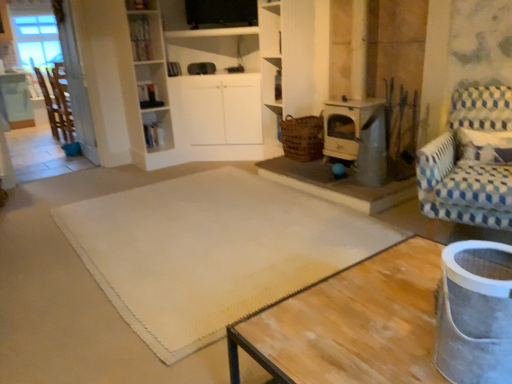
Question: Can you confirm if brushed metal table at left is smaller than white textured mat at center?

Choices:
 (A) no
 (B) yes

Answer: (B)

Question: Is the depth of brushed metal table at left greater than that of white textured mat at center?

Choices:
 (A) yes
 (B) no

Answer: (A)

Question: Is brushed metal table at left taller than white textured mat at center?

Choices:
 (A) yes
 (B) no

Answer: (A)

Question: From the image's perspective, is brushed metal table at left below white textured mat at center?

Choices:
 (A) no
 (B) yes

Answer: (A)

Question: Is brushed metal table at left directly adjacent to white textured mat at center?

Choices:
 (A) no
 (B) yes

Answer: (A)

Question: Is brushed metal table at left positioned far away from white textured mat at center?

Choices:
 (A) yes
 (B) no

Answer: (A)

Question: Is brushed metal table at left outside of wooden chair at left, marked as the 2th chair in a right-to-left arrangement?

Choices:
 (A) yes
 (B) no

Answer: (A)

Question: Does brushed metal table at left contain wooden chair at left, the 1th chair in the back-to-front sequence?

Choices:
 (A) yes
 (B) no

Answer: (B)

Question: From a real-world perspective, does brushed metal table at left stand above wooden chair at left, which is the second chair in front-to-back order?

Choices:
 (A) yes
 (B) no

Answer: (B)

Question: Is brushed metal table at left at the left side of wooden chair at left, the 1th chair in the back-to-front sequence?

Choices:
 (A) no
 (B) yes

Answer: (B)

Question: From the image's perspective, is brushed metal table at left located beneath wooden chair at left, marked as the 2th chair in a right-to-left arrangement?

Choices:
 (A) no
 (B) yes

Answer: (A)

Question: Can you confirm if brushed metal table at left is positioned to the right of wooden chair at left, which appears as the 2th chair when ordered from the bottom?

Choices:
 (A) no
 (B) yes

Answer: (A)

Question: Is metallic stove at center-right shorter than brushed metal table at left?

Choices:
 (A) no
 (B) yes

Answer: (B)